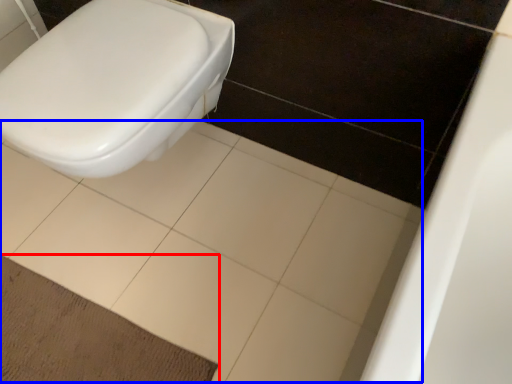
Question: Which point is further to the camera, doormat (highlighted by a red box) or ceramic tile (highlighted by a blue box)?

Choices:
 (A) doormat
 (B) ceramic tile

Answer: (A)